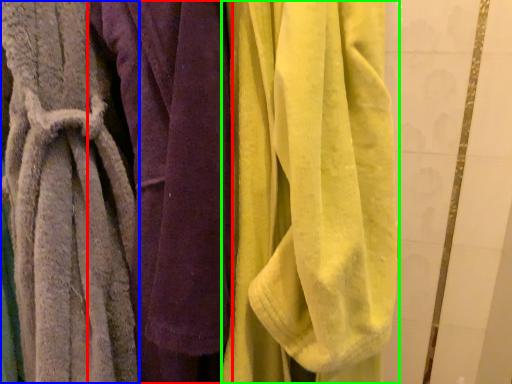
Question: Based on their relative distances, which object is farther from towel (highlighted by a red box)? Choose from towel (highlighted by a blue box) and towel (highlighted by a green box).

Choices:
 (A) towel
 (B) towel

Answer: (B)